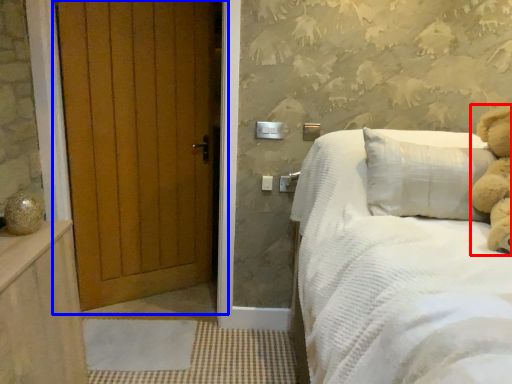
Question: Which of the following is the farthest to the observer, teddy (highlighted by a red box) or door (highlighted by a blue box)?

Choices:
 (A) teddy
 (B) door

Answer: (B)